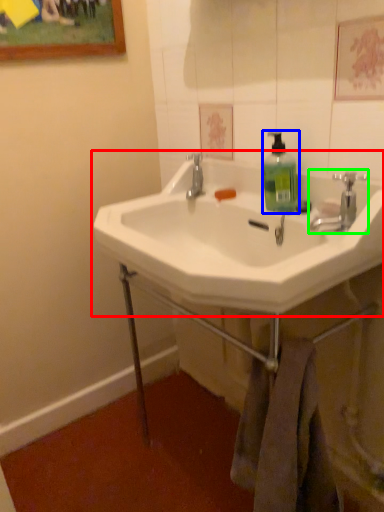
Question: Estimate the real-world distances between objects in this image. Which object is closer to sink (highlighted by a red box), soap dispenser (highlighted by a blue box) or tap (highlighted by a green box)?

Choices:
 (A) soap dispenser
 (B) tap

Answer: (A)